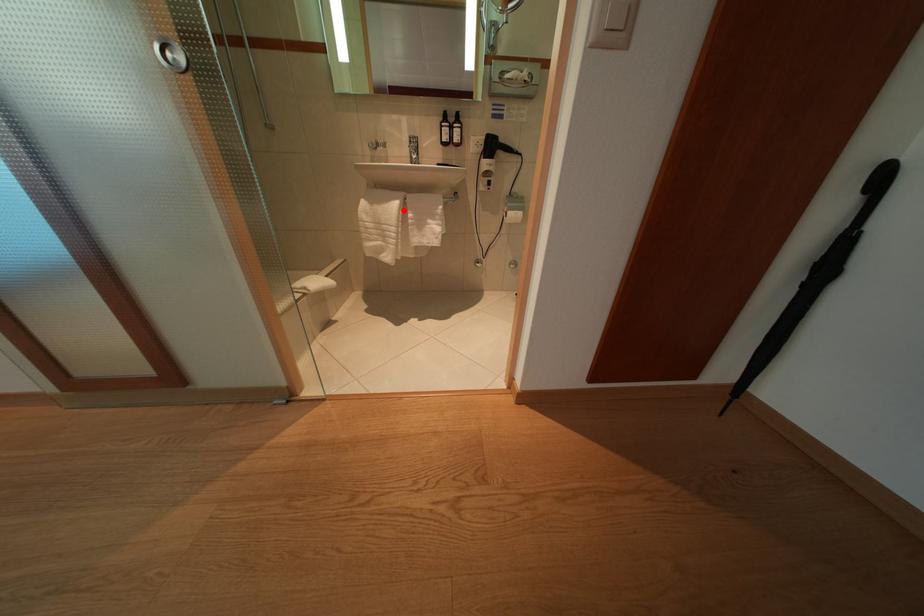
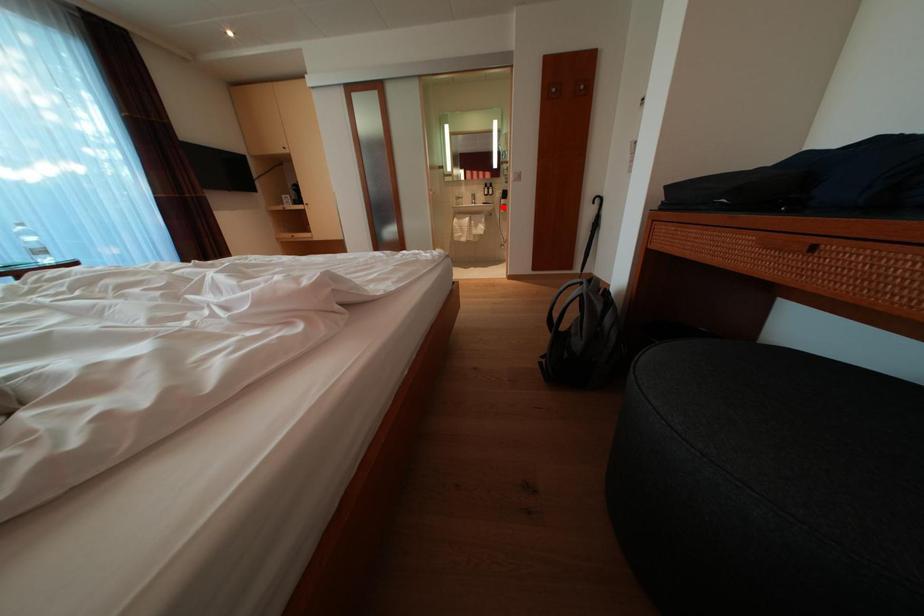
I am providing you with two images of the same scene from different viewpoints. A red point is marked on the first image and another point is marked on the second image. Do the highlighted points in image1 and image2 indicate the same real-world spot?

No